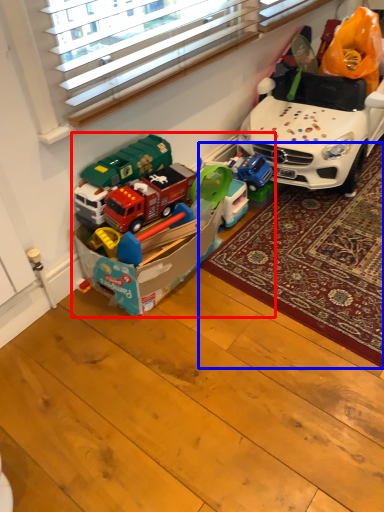
Question: Which point is further to the camera, toy (highlighted by a red box) or mat (highlighted by a blue box)?

Choices:
 (A) toy
 (B) mat

Answer: (B)